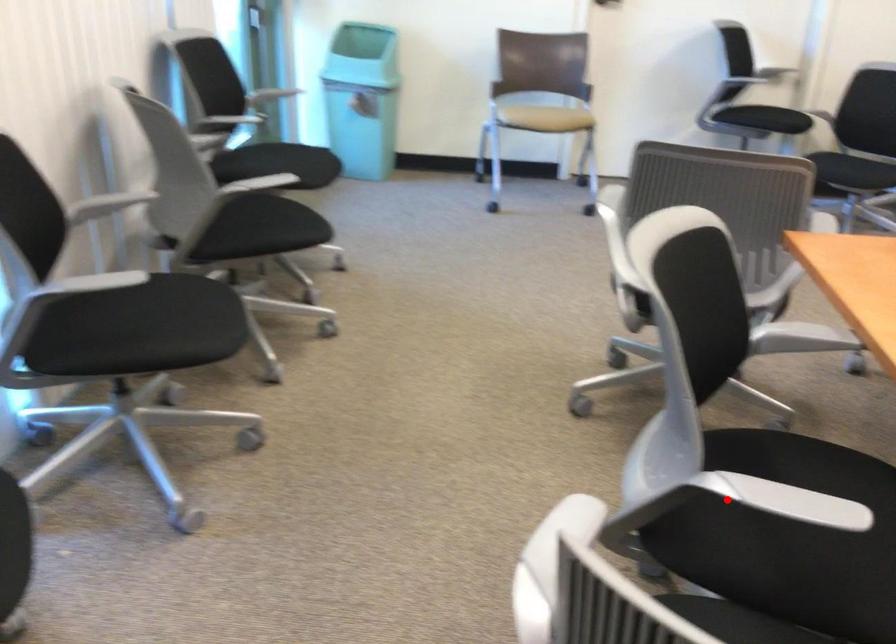
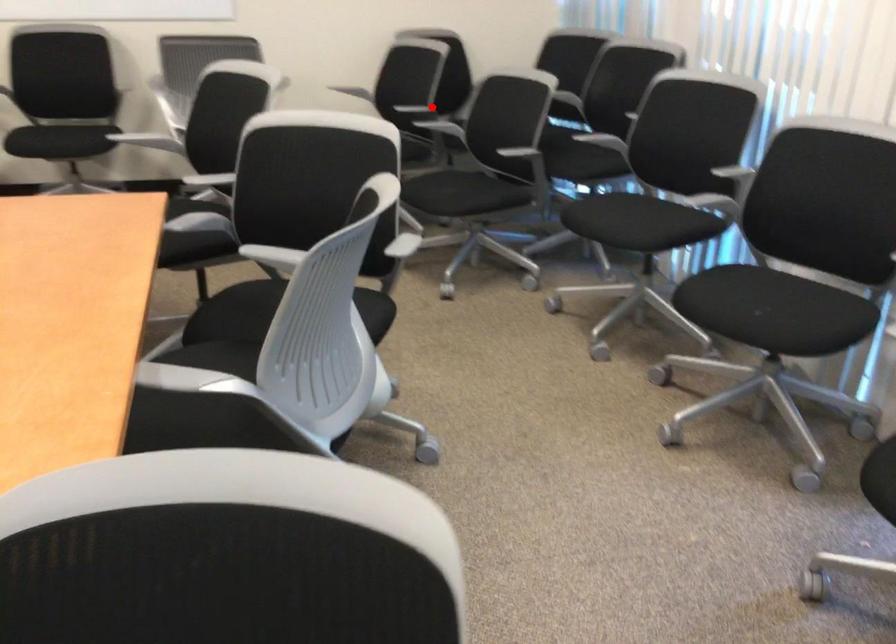
I am providing you with two images of the same scene from different viewpoints. A red point is marked on the first image and another point is marked on the second image. Is the marked point in image1 the same physical position as the marked point in image2?

No